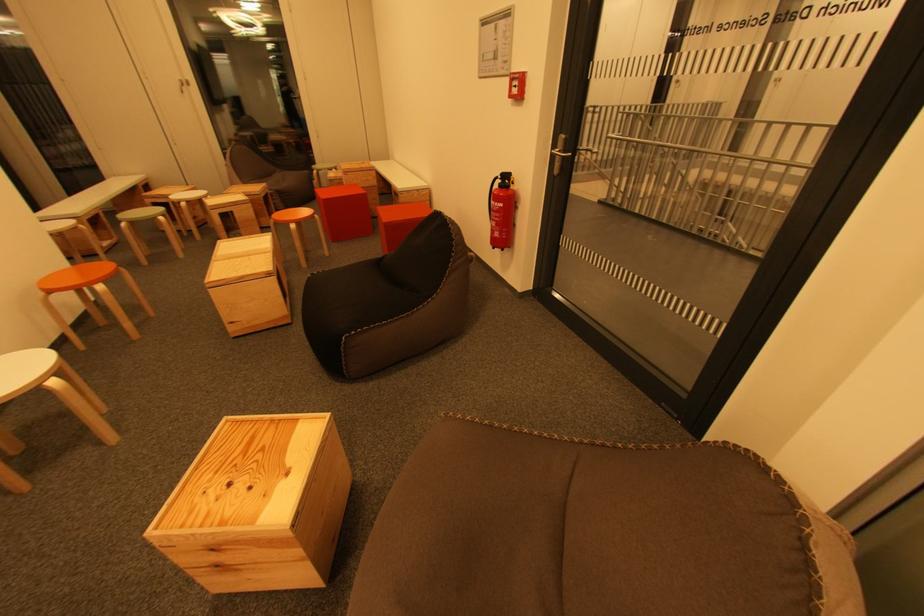
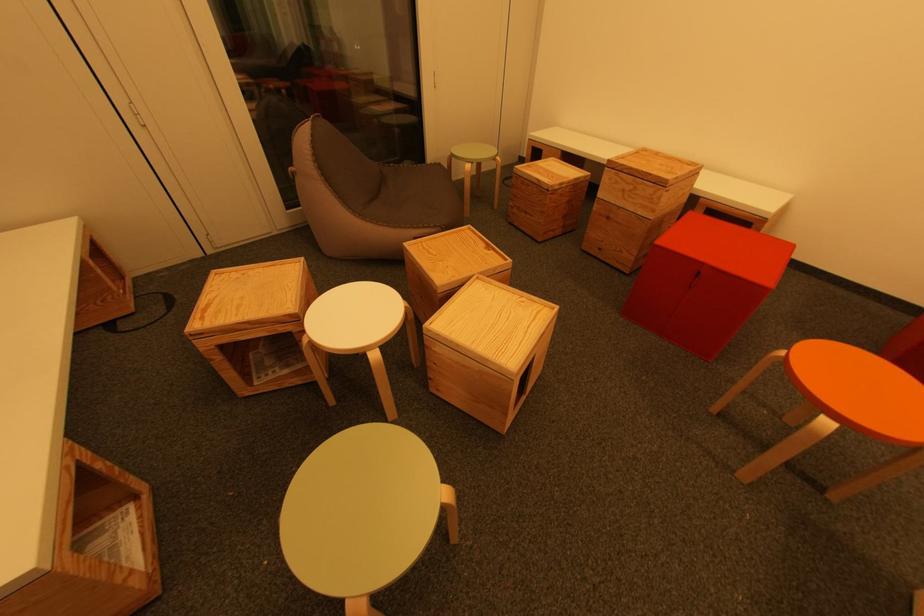
Which direction would the cameraman need to move to produce the second image?

The cameraman walked toward left, forward.